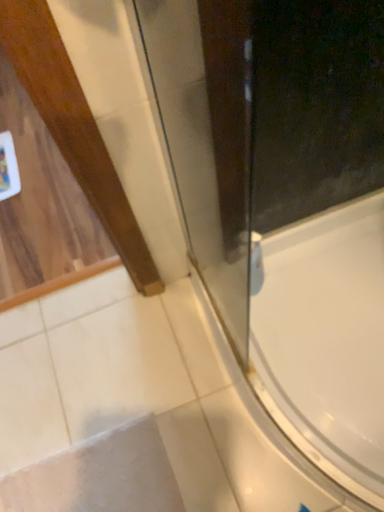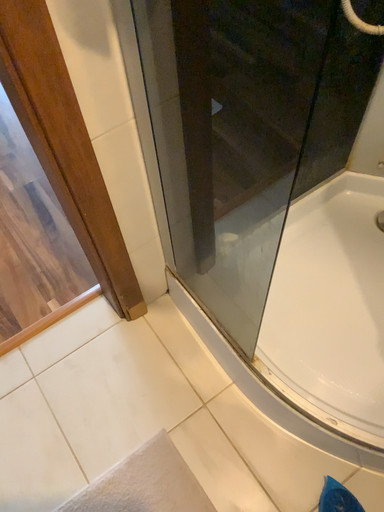
Question: How did the camera likely rotate when shooting the video?

Choices:
 (A) rotated upward
 (B) rotated downward

Answer: (A)